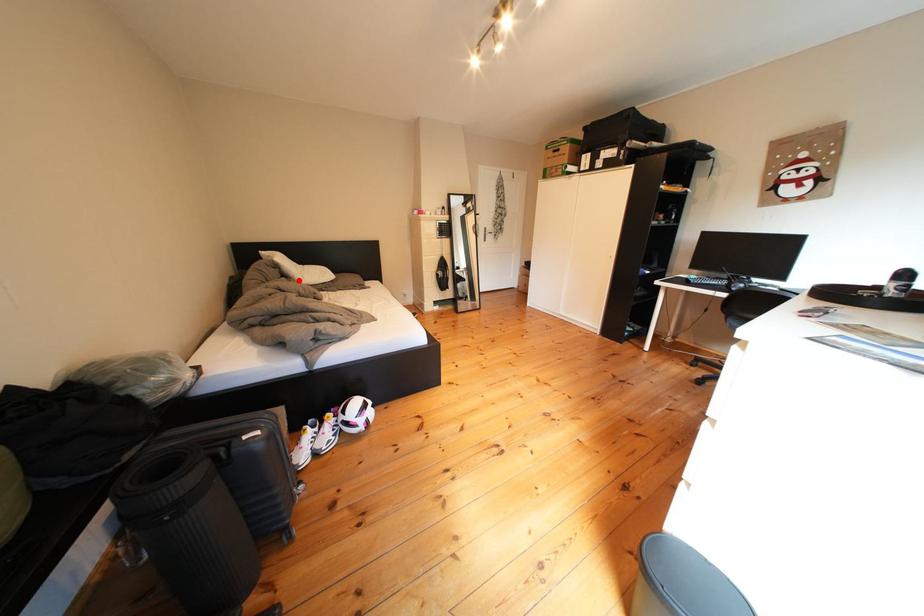
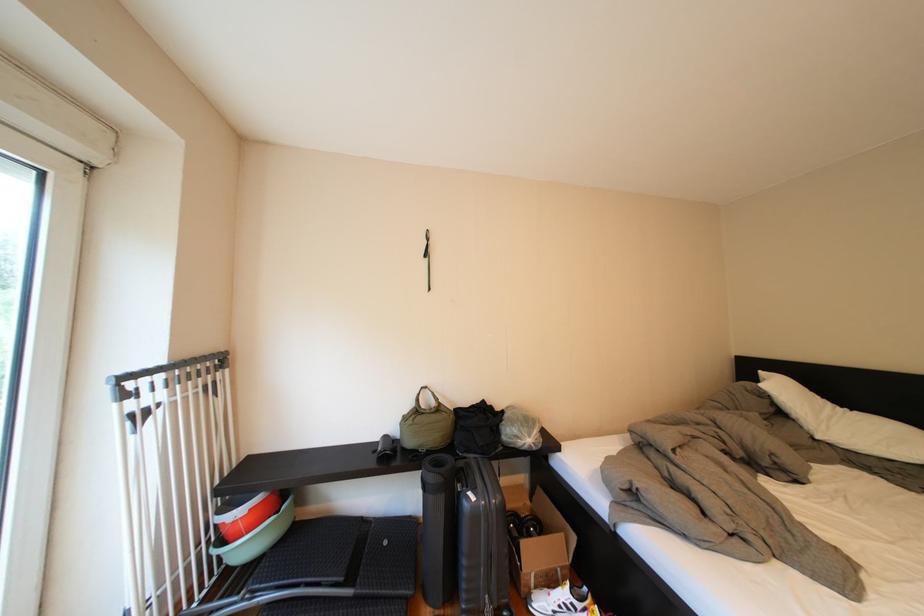
Locate, in the second image, the point that corresponds to the highlighted location in the first image.

(795, 419)